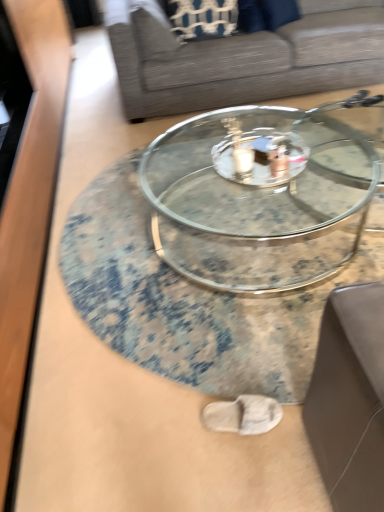
Question: From a real-world perspective, does transparent glass coffee table at center, the first coffee table viewed from the front, sit lower than gray fabric couch at center?

Choices:
 (A) yes
 (B) no

Answer: (A)

Question: Is transparent glass coffee table at center, marked as the 2th coffee table in a back-to-front arrangement, bigger than gray fabric couch at center?

Choices:
 (A) no
 (B) yes

Answer: (A)

Question: Does transparent glass coffee table at center, the first coffee table viewed from the front, come behind gray fabric couch at center?

Choices:
 (A) no
 (B) yes

Answer: (A)

Question: Can you see transparent glass coffee table at center, marked as the 2th coffee table in a back-to-front arrangement, touching gray fabric couch at center?

Choices:
 (A) no
 (B) yes

Answer: (A)

Question: Is transparent glass coffee table at center, the first coffee table viewed from the front, positioned in front of gray fabric couch at center?

Choices:
 (A) no
 (B) yes

Answer: (B)

Question: Looking at the image, does gray fabric couch at center seem bigger or smaller compared to clear glass coffee table at center, the 1th coffee table when ordered from back to front?

Choices:
 (A) small
 (B) big

Answer: (B)

Question: From the image's perspective, is gray fabric couch at center positioned above or below clear glass coffee table at center, the 2th coffee table from the front?

Choices:
 (A) above
 (B) below

Answer: (A)

Question: In terms of height, does gray fabric couch at center look taller or shorter compared to clear glass coffee table at center, the 1th coffee table when ordered from back to front?

Choices:
 (A) tall
 (B) short

Answer: (A)

Question: Is point (132, 28) closer or farther from the camera than point (198, 189)?

Choices:
 (A) farther
 (B) closer

Answer: (A)

Question: Is clear glass coffee table at center, the 1th coffee table when ordered from back to front, inside or outside of transparent glass coffee table at center, marked as the 2th coffee table in a back-to-front arrangement?

Choices:
 (A) inside
 (B) outside

Answer: (B)

Question: Relative to transparent glass coffee table at center, the first coffee table viewed from the front, is clear glass coffee table at center, the 2th coffee table from the front, in front or behind?

Choices:
 (A) front
 (B) behind

Answer: (B)

Question: In terms of height, does clear glass coffee table at center, the 1th coffee table when ordered from back to front, look taller or shorter compared to transparent glass coffee table at center, marked as the 2th coffee table in a back-to-front arrangement?

Choices:
 (A) tall
 (B) short

Answer: (A)

Question: Is point (163, 193) closer or farther from the camera than point (288, 350)?

Choices:
 (A) farther
 (B) closer

Answer: (A)

Question: Do you think gray fabric couch at center is within transparent glass coffee table at center, the first coffee table viewed from the front, or outside of it?

Choices:
 (A) outside
 (B) inside

Answer: (A)

Question: From a real-world perspective, relative to transparent glass coffee table at center, marked as the 2th coffee table in a back-to-front arrangement, is gray fabric couch at center vertically above or below?

Choices:
 (A) above
 (B) below

Answer: (A)